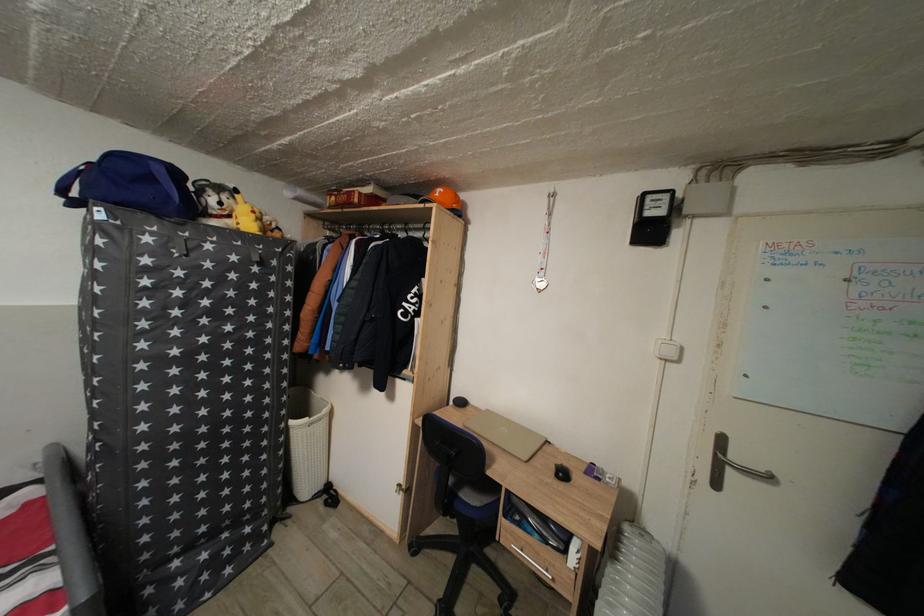
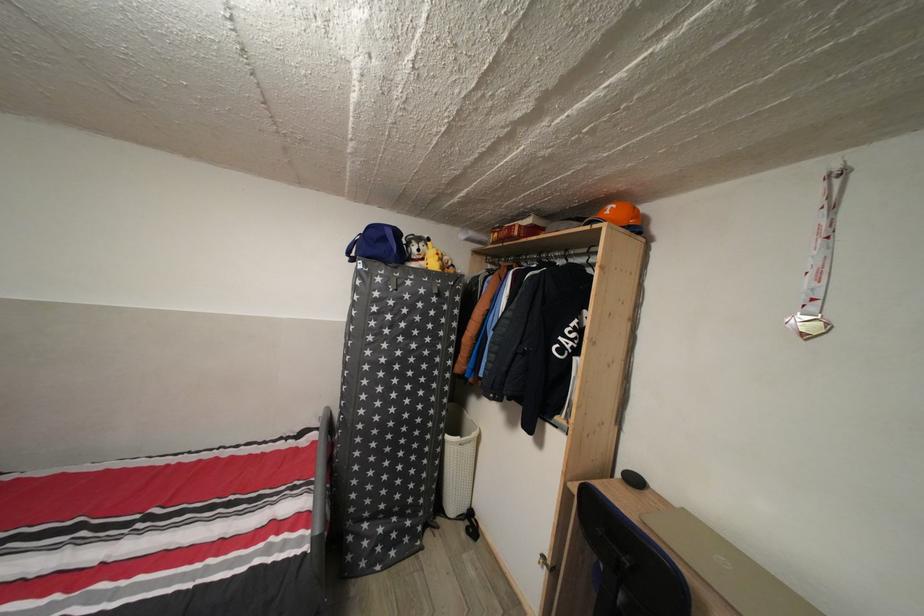
Question: The first image is from the beginning of the video and the second image is from the end. How did the camera likely rotate when shooting the video?

Choices:
 (A) Left
 (B) Right
 (C) Up
 (D) Down

Answer: (A)